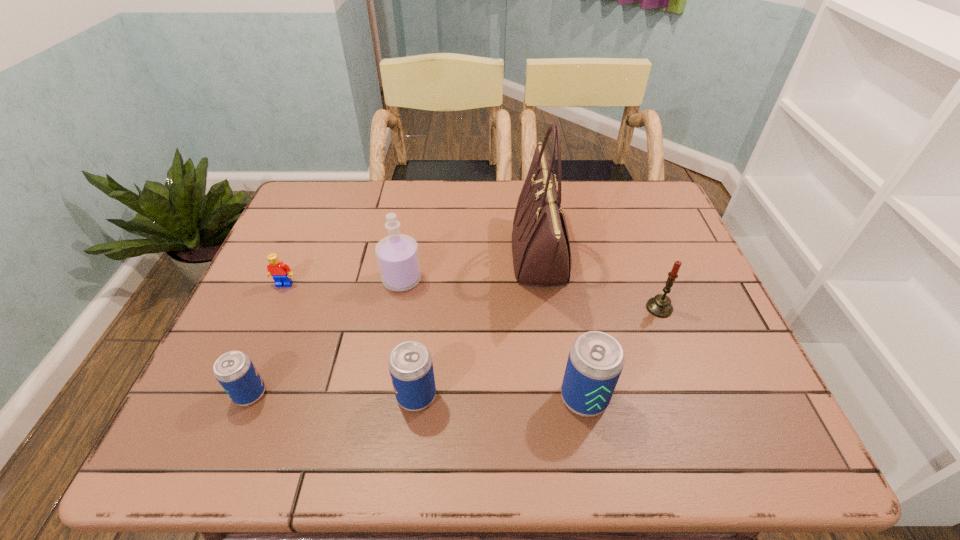
Locate an element on the screen. The image size is (960, 540). free region that satisfies the following two spatial constraints: 1. on the front side of the sixth shortest object; 2. on the right side of the second shortest beer can is located at coordinates (381, 396).

The image size is (960, 540). I want to click on free location that satisfies the following two spatial constraints: 1. on the front-facing side of the Lego; 2. on the left side of the second beer can from right to left, so click(236, 396).

The height and width of the screenshot is (540, 960). I want to click on vacant region that satisfies the following two spatial constraints: 1. on the front-facing side of the tallest object; 2. on the front side of the leftmost beer can, so click(560, 394).

At what (x,y) coordinates should I click in order to perform the action: click on free space that satisfies the following two spatial constraints: 1. on the front-facing side of the candle; 2. on the left side of the Lego. Please return your answer as a coordinate pair (x, y). Looking at the image, I should click on (275, 308).

Identify the location of free point that satisfies the following two spatial constraints: 1. on the front-facing side of the rightmost object; 2. on the left side of the Lego. The width and height of the screenshot is (960, 540). (275, 308).

The height and width of the screenshot is (540, 960). Find the location of `vacant space that satisfies the following two spatial constraints: 1. on the back side of the rightmost object; 2. on the left side of the tallest beer can`. vacant space that satisfies the following two spatial constraints: 1. on the back side of the rightmost object; 2. on the left side of the tallest beer can is located at coordinates (567, 308).

The image size is (960, 540). I want to click on vacant region that satisfies the following two spatial constraints: 1. on the front-facing side of the Lego; 2. on the right side of the leftmost beer can, so click(x=237, y=394).